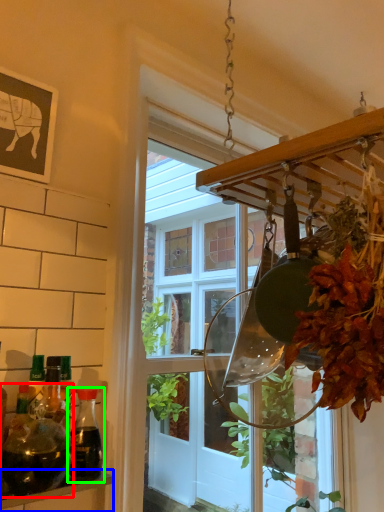
Question: Considering the real-world distances, which object is closest to bottle (highlighted by a red box)? shelf (highlighted by a blue box) or bottle (highlighted by a green box).

Choices:
 (A) shelf
 (B) bottle

Answer: (B)